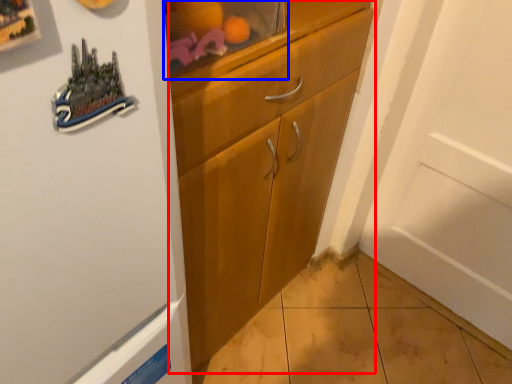
Question: Which point is further to the camera, cabinetry (highlighted by a red box) or shelf (highlighted by a blue box)?

Choices:
 (A) cabinetry
 (B) shelf

Answer: (A)